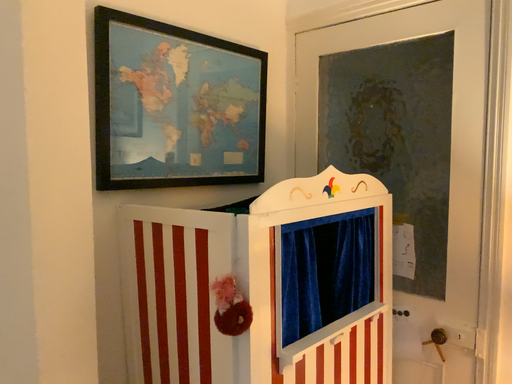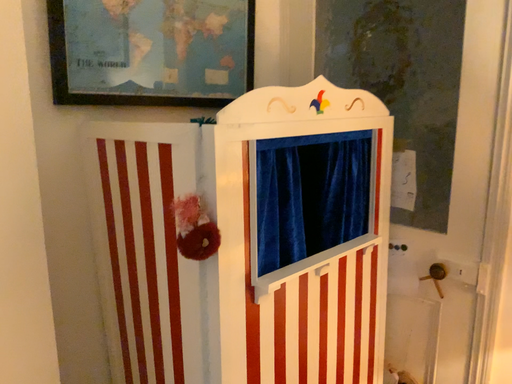
Question: How did the camera likely rotate when shooting the video?

Choices:
 (A) rotated downward
 (B) rotated upward

Answer: (A)